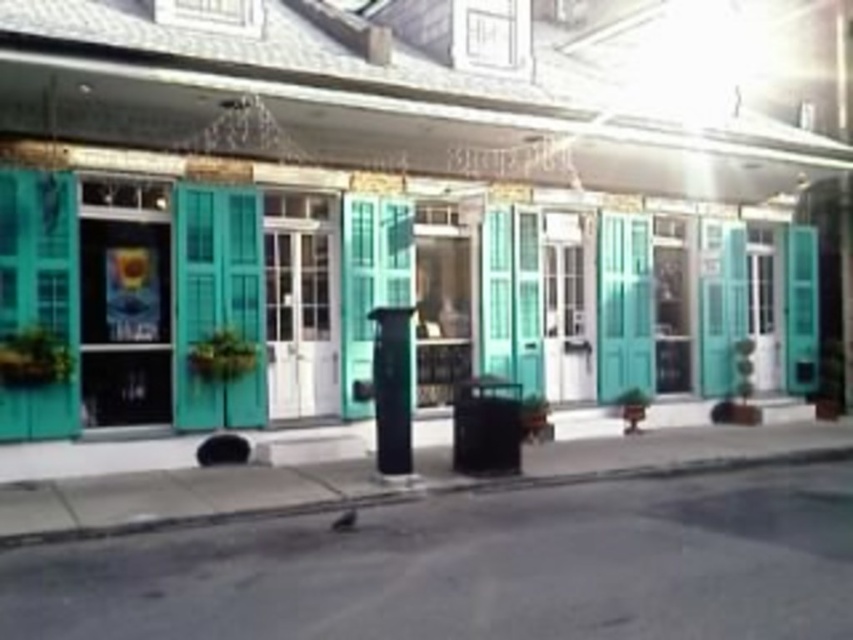
You are standing on the sidewalk in front of the row of French Quarter style storefronts. There are potted plants along the edge of the sidewalk. You notice a point marked at coordinates [410,195]. What object is located at this point?

The point at coordinates [410,195] marks the teal matte shutters at center.

Looking at this image, you are a delivery person trying to place a package on the sidewalk. You see the concrete at lower left and the teal matte shutters at center. Which one is closer to you as you stand in front of the storefronts?

The concrete at lower left is behind the teal matte shutters at center, so the teal matte shutters at center are closer to you.

You are a delivery person trying to determine if a tall package can fit between the teal matte shutters at center and the concrete at lower left. Which object is taller?

The teal matte shutters at center is taller than the concrete at lower left, so the package can fit as long as its height does not exceed the height of the teal matte shutters at center.